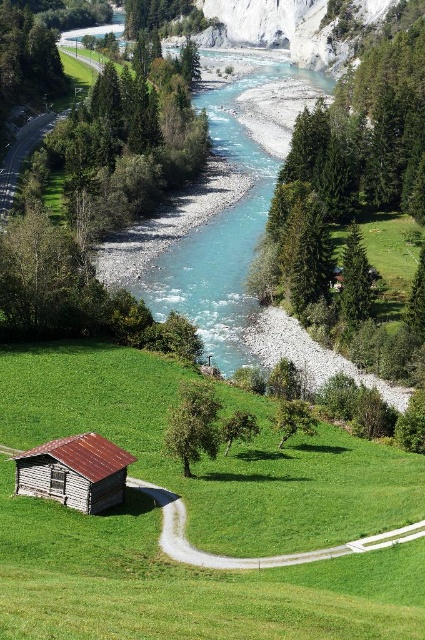
Based on the photo, can you confirm if turquoise smooth water at center is positioned below rustic wood cabin at lower left?

No.

Is turquoise smooth water at center behind rustic wood cabin at lower left?

Yes, turquoise smooth water at center is further from the viewer.

Find the location of a particular element. The image size is (425, 640). turquoise smooth water at center is located at coordinates (223, 209).

In order to click on turquoise smooth water at center in this screenshot , I will do `click(223, 209)`.